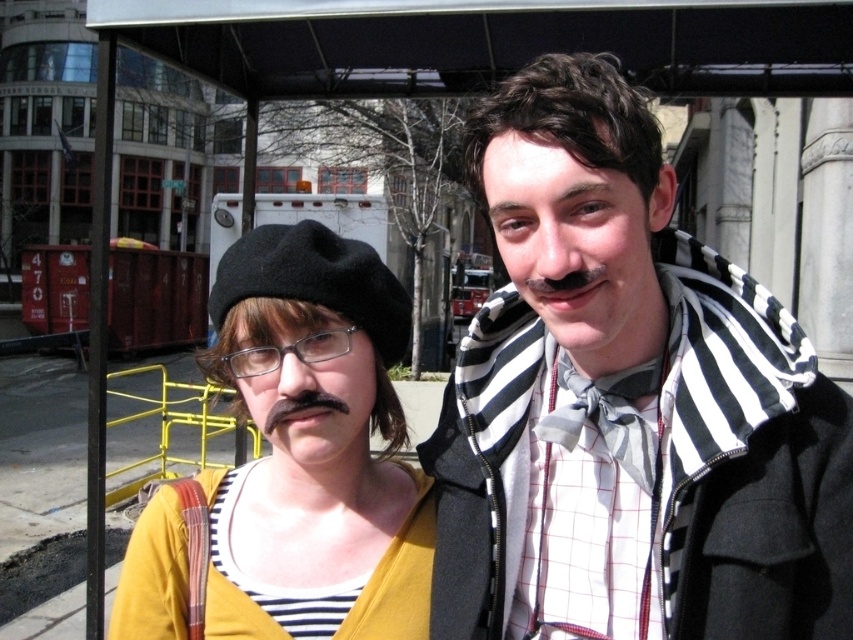
What object is located at the coordinates point (312, 445) in the image?

The point (312, 445) corresponds to the yellow striped shirt at center.

You are a photographer standing at the edge of the scene. You want to take a photo of the striped scarf at center without including the camera in the frame. What is the minimum distance you need to move forward to ensure the camera is out of the shot?

The striped scarf at center and camera are 1.06 meters apart. To exclude the camera from the photo, you need to move forward at least 1.06 meters so that the distance between you and the camera becomes greater than the distance to the striped scarf at center, ensuring the camera is no longer in frame.